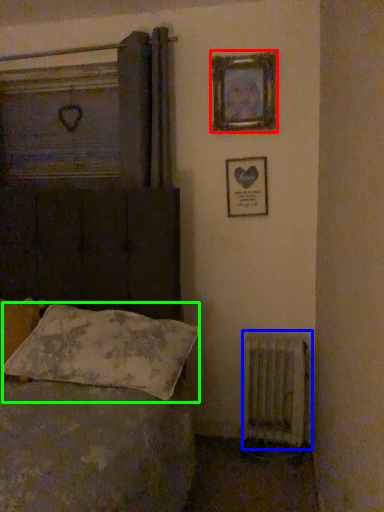
Question: Based on their relative distances, which object is farther from picture frame (highlighted by a red box)? Choose from radiator (highlighted by a blue box) and pillow (highlighted by a green box).

Choices:
 (A) radiator
 (B) pillow

Answer: (A)